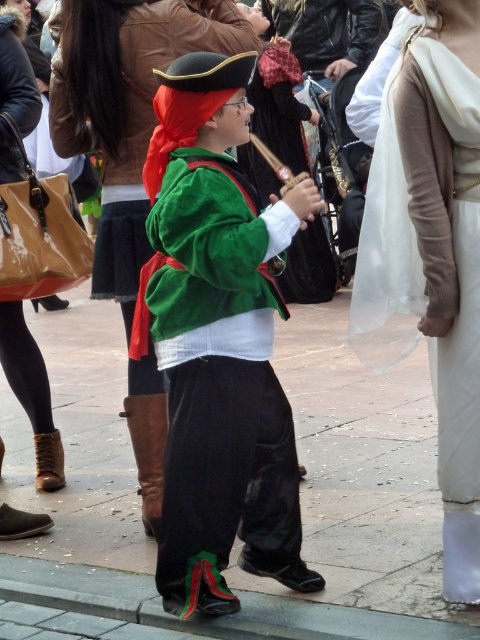
You are a delivery drone that needs to land on the smooth concrete pavement at center. However, there is a velvet green jacket at center in the way. Can you safely land on the pavement without disturbing the jacket?

The velvet green jacket at center is behind the smooth concrete pavement at center, meaning it is not blocking the landing area. The drone can safely land on the smooth concrete pavement at center without disturbing the jacket.

Based on the scene description, what is the significance of the point at coordinates [237,540]?

The point at coordinates [237,540] represents the location of the smooth concrete pavement at center in the scene.

You are standing in the middle of the street and want to walk to the edge of the crowd. The point at coordinates (237,540) is smooth concrete pavement at center. Which direction should you walk to reach the edge of the crowd?

The point at coordinates (237,540) corresponds to the smooth concrete pavement at center. To reach the edge of the crowd, you should walk away from the center towards the direction where the crowd density decreases.